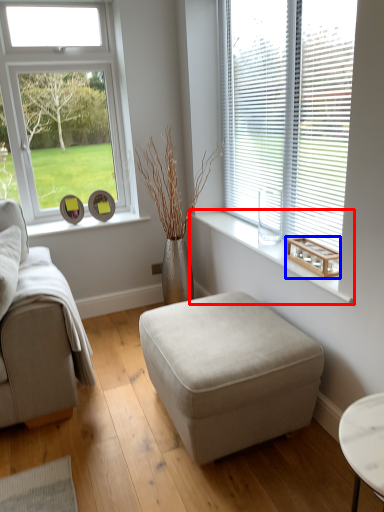
Question: Which object is further to the camera taking this photo, window sill (highlighted by a red box) or wood (highlighted by a blue box)?

Choices:
 (A) window sill
 (B) wood

Answer: (B)